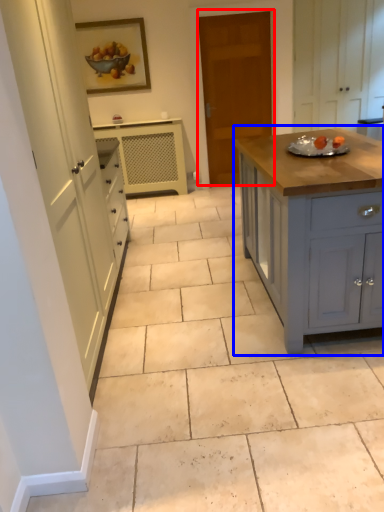
Question: Which point is closer to the camera, door (highlighted by a red box) or cabinetry (highlighted by a blue box)?

Choices:
 (A) door
 (B) cabinetry

Answer: (B)